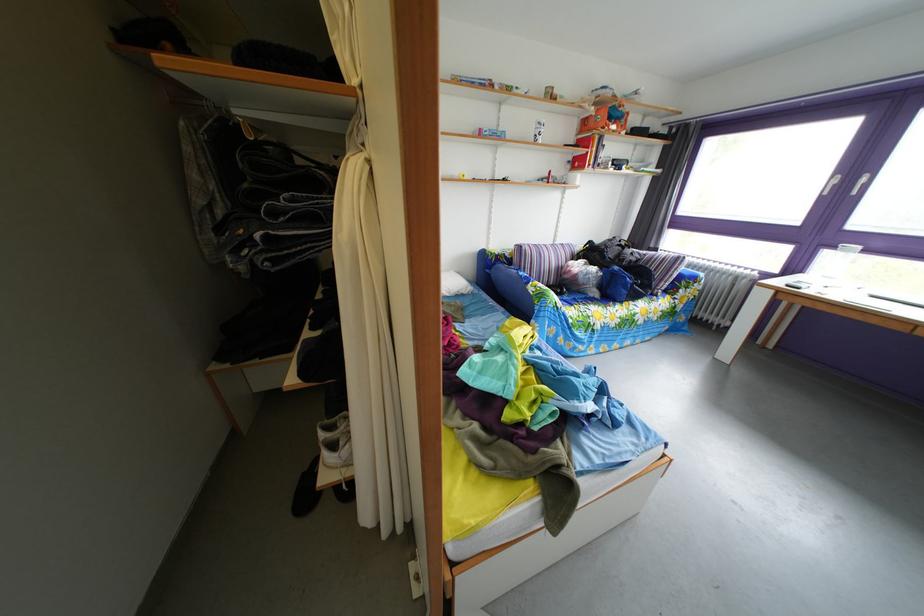
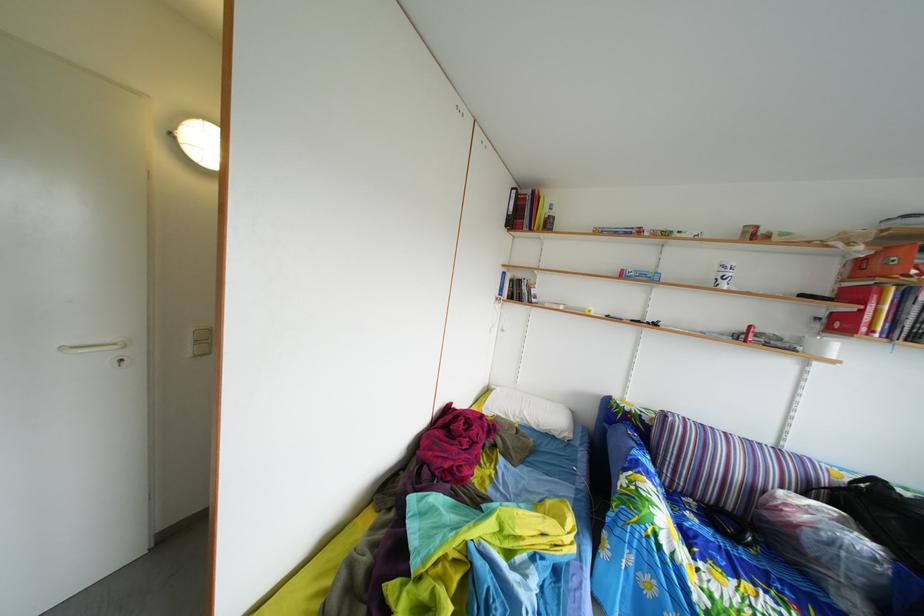
In the second image, find the point that corresponds to (602,262) in the first image.

(886, 515)